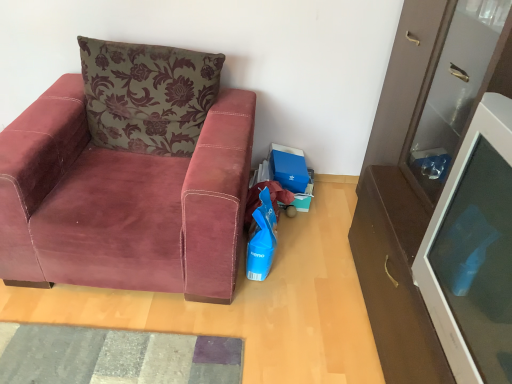
Question: Looking at their shapes, would you say velvet maroon armchair at left is wider or thinner than velvet floral pillow at upper left?

Choices:
 (A) thin
 (B) wide

Answer: (B)

Question: From the image's perspective, is velvet maroon armchair at left located above or below velvet floral pillow at upper left?

Choices:
 (A) below
 (B) above

Answer: (A)

Question: Which of these objects is positioned closest to the velvet maroon armchair at left?

Choices:
 (A) velvet floral pillow at upper left
 (B) textured gray mat at lower left
 (C) white glossy cabinet at right

Answer: (A)

Question: Which object is the farthest from the textured gray mat at lower left?

Choices:
 (A) velvet maroon armchair at left
 (B) velvet floral pillow at upper left
 (C) white glossy cabinet at right

Answer: (C)